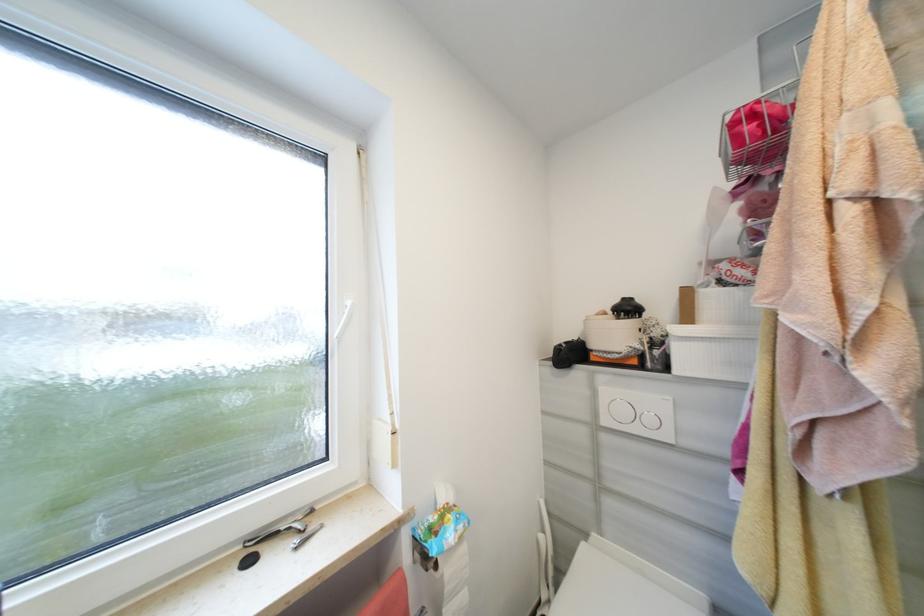
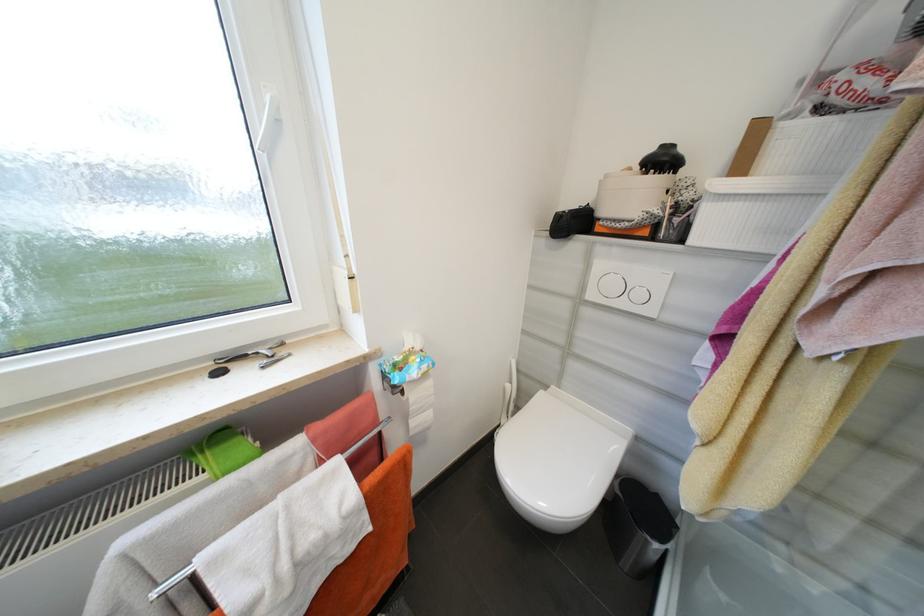
In the second image, find the point that corresponds to pixel 546 537 in the first image.

(514, 387)